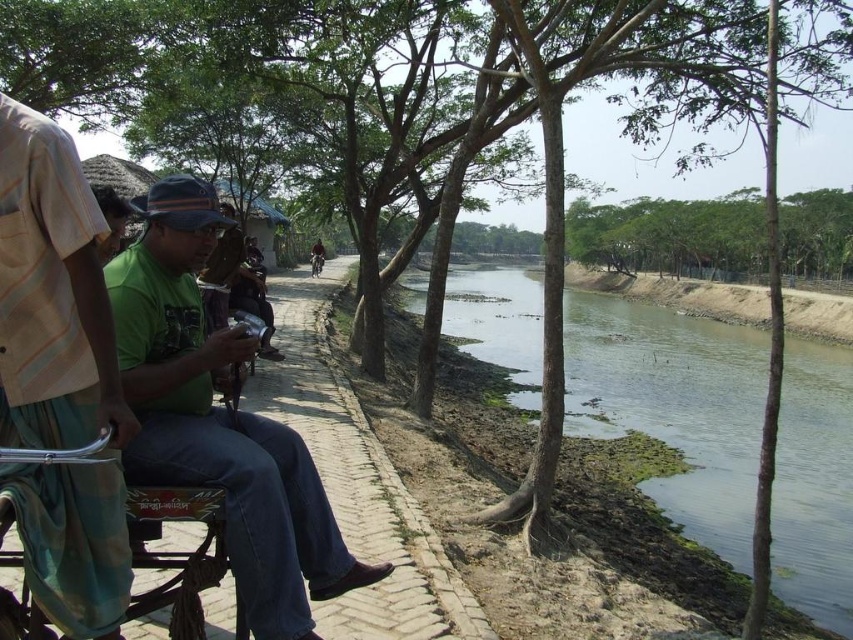
Question: Does light brown fabric shirt at left appear under green matte shirt at center?

Choices:
 (A) no
 (B) yes

Answer: (A)

Question: Does green algae-covered water at center have a larger size compared to light brown fabric shirt at left?

Choices:
 (A) no
 (B) yes

Answer: (B)

Question: Can you confirm if light brown fabric shirt at left is bigger than green matte shirt at center?

Choices:
 (A) no
 (B) yes

Answer: (A)

Question: Which point is farther from the camera taking this photo?

Choices:
 (A) click(311, 269)
 (B) click(74, 468)

Answer: (A)

Question: Among these objects, which one is farthest from the camera?

Choices:
 (A) green matte shirt at center
 (B) dark brown leather jacket at center
 (C) light brown fabric shirt at left
 (D) green algae-covered water at center

Answer: (B)

Question: Among these points, which one is nearest to the camera?

Choices:
 (A) (608, 358)
 (B) (323, 253)
 (C) (103, 340)
 (D) (308, 467)

Answer: (C)